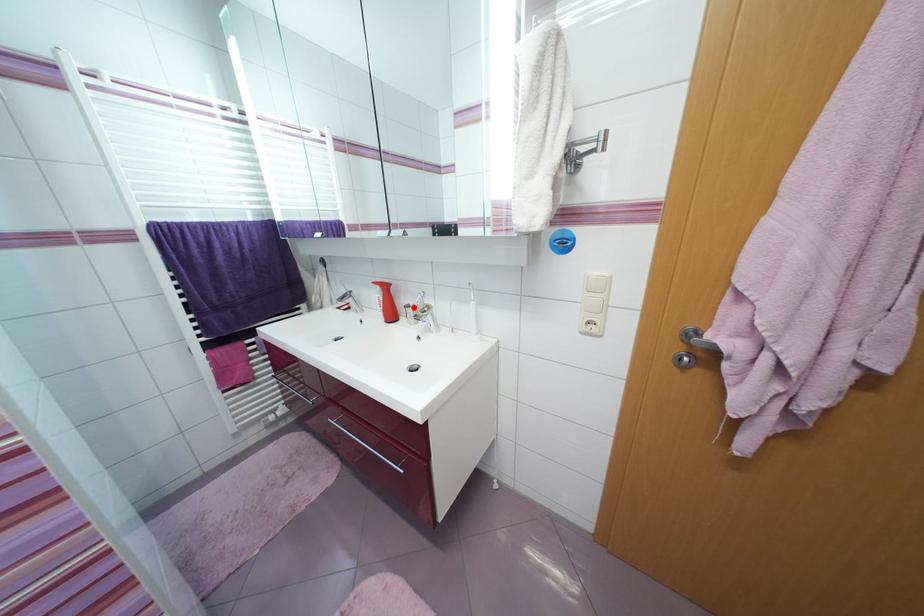
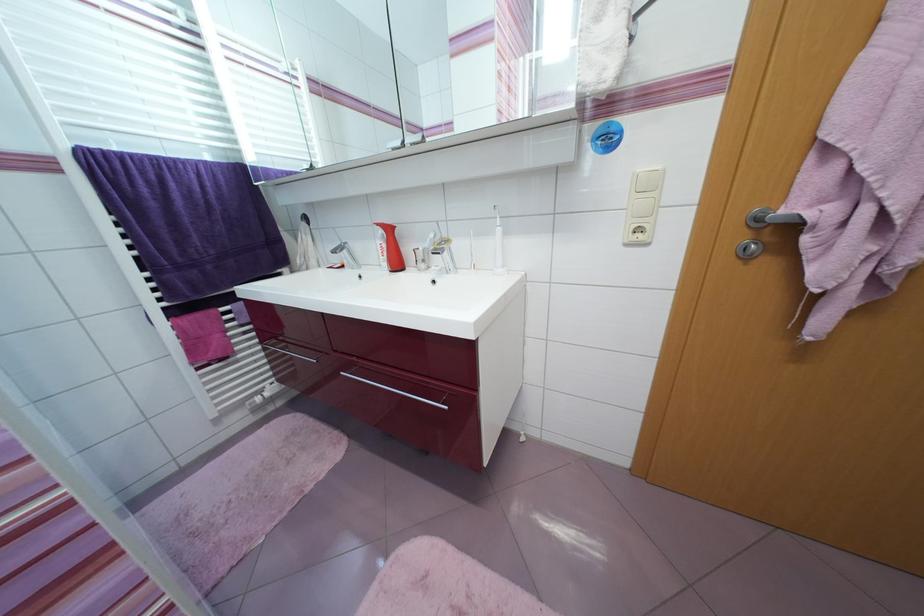
Question: I am providing you with two images of the same scene from different viewpoints. In image1, a red point is highlighted. Considering the same 3D point in image2, which of the following is correct?

Choices:
 (A) It is closer
 (B) It is farther

Answer: (A)